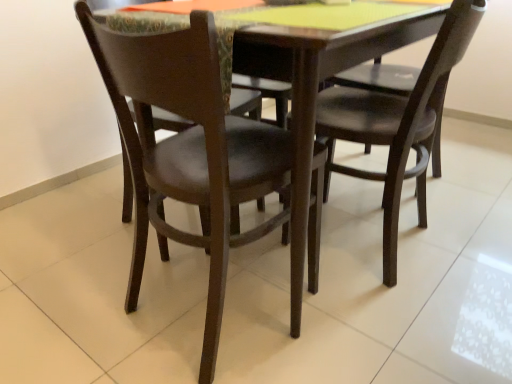
Question: In which direction should I rotate to look at matte dark brown chair at center, marked as the 1th chair in a left-to-right arrangement?

Choices:
 (A) left
 (B) right

Answer: (A)

Question: Should I look upward or downward to see matte black chair at center, which ranks as the second chair in left-to-right order?

Choices:
 (A) down
 (B) up

Answer: (B)

Question: From the image's perspective, is matte black chair at center, which ranks as the second chair in left-to-right order, beneath matte dark brown chair at center, arranged as the 2th chair when viewed from the right?

Choices:
 (A) yes
 (B) no

Answer: (B)

Question: Would you say matte dark brown chair at center, arranged as the 2th chair when viewed from the right, is part of matte black chair at center, the first chair in the right-to-left sequence,'s contents?

Choices:
 (A) no
 (B) yes

Answer: (A)

Question: Considering the relative sizes of matte black chair at center, which ranks as the second chair in left-to-right order, and matte dark brown chair at center, marked as the 1th chair in a left-to-right arrangement, in the image provided, is matte black chair at center, which ranks as the second chair in left-to-right order, bigger than matte dark brown chair at center, marked as the 1th chair in a left-to-right arrangement,?

Choices:
 (A) no
 (B) yes

Answer: (B)

Question: Considering the relative positions of matte black chair at center, which ranks as the second chair in left-to-right order, and matte dark brown chair at center, arranged as the 2th chair when viewed from the right, in the image provided, is matte black chair at center, which ranks as the second chair in left-to-right order, behind matte dark brown chair at center, arranged as the 2th chair when viewed from the right,?

Choices:
 (A) no
 (B) yes

Answer: (B)

Question: From a real-world perspective, does matte black chair at center, the first chair in the right-to-left sequence, stand above matte dark brown chair at center, arranged as the 2th chair when viewed from the right?

Choices:
 (A) no
 (B) yes

Answer: (B)

Question: Does matte black chair at center, which ranks as the second chair in left-to-right order, have a smaller size compared to matte dark brown chair at center, marked as the 1th chair in a left-to-right arrangement?

Choices:
 (A) no
 (B) yes

Answer: (A)

Question: Considering the relative sizes of matte dark brown chair at center, marked as the 1th chair in a left-to-right arrangement, and matte black chair at center, which ranks as the second chair in left-to-right order, in the image provided, is matte dark brown chair at center, marked as the 1th chair in a left-to-right arrangement, thinner than matte black chair at center, which ranks as the second chair in left-to-right order,?

Choices:
 (A) yes
 (B) no

Answer: (B)

Question: Can you confirm if matte dark brown chair at center, arranged as the 2th chair when viewed from the right, is positioned to the left of matte black chair at center, which ranks as the second chair in left-to-right order?

Choices:
 (A) no
 (B) yes

Answer: (B)

Question: Is matte dark brown chair at center, marked as the 1th chair in a left-to-right arrangement, bigger than matte black chair at center, the first chair in the right-to-left sequence?

Choices:
 (A) no
 (B) yes

Answer: (A)

Question: Is the position of matte dark brown chair at center, marked as the 1th chair in a left-to-right arrangement, more distant than that of matte black chair at center, the first chair in the right-to-left sequence?

Choices:
 (A) yes
 (B) no

Answer: (B)

Question: Is matte dark brown chair at center, marked as the 1th chair in a left-to-right arrangement, outside matte black chair at center, the first chair in the right-to-left sequence?

Choices:
 (A) no
 (B) yes

Answer: (B)

Question: Is matte dark brown chair at center, arranged as the 2th chair when viewed from the right, far away from matte black chair at center, which ranks as the second chair in left-to-right order?

Choices:
 (A) yes
 (B) no

Answer: (B)

Question: Is matte dark brown chair at center, arranged as the 2th chair when viewed from the right, in front of or behind matte black chair at center, which ranks as the second chair in left-to-right order, in the image?

Choices:
 (A) behind
 (B) front

Answer: (B)